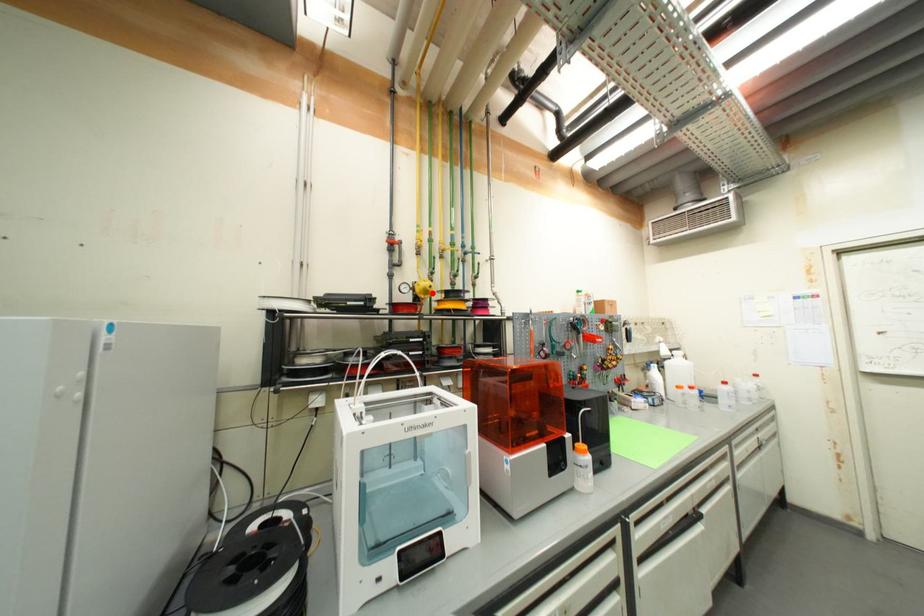
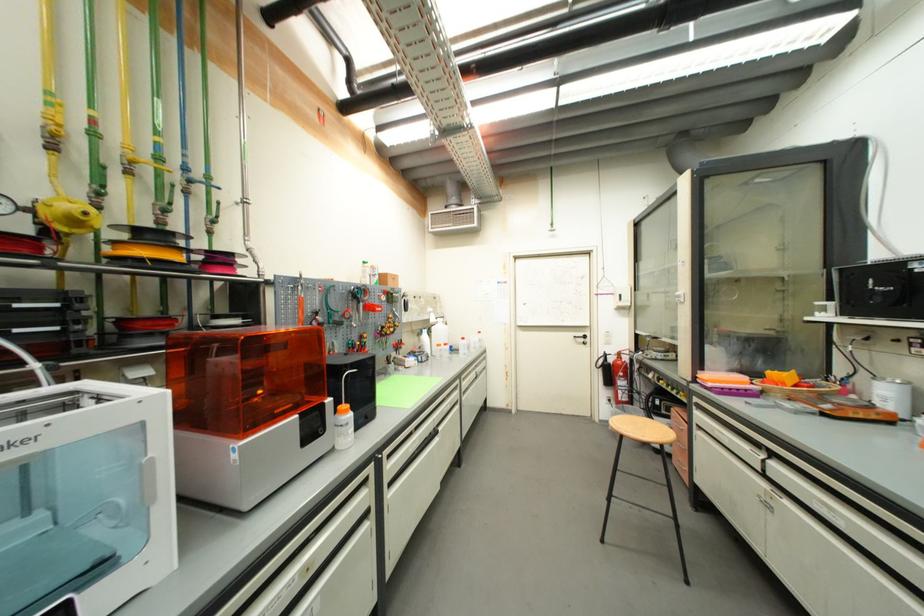
Locate, in the second image, the point that corresponds to the highlighted location in the first image.

(82, 224)